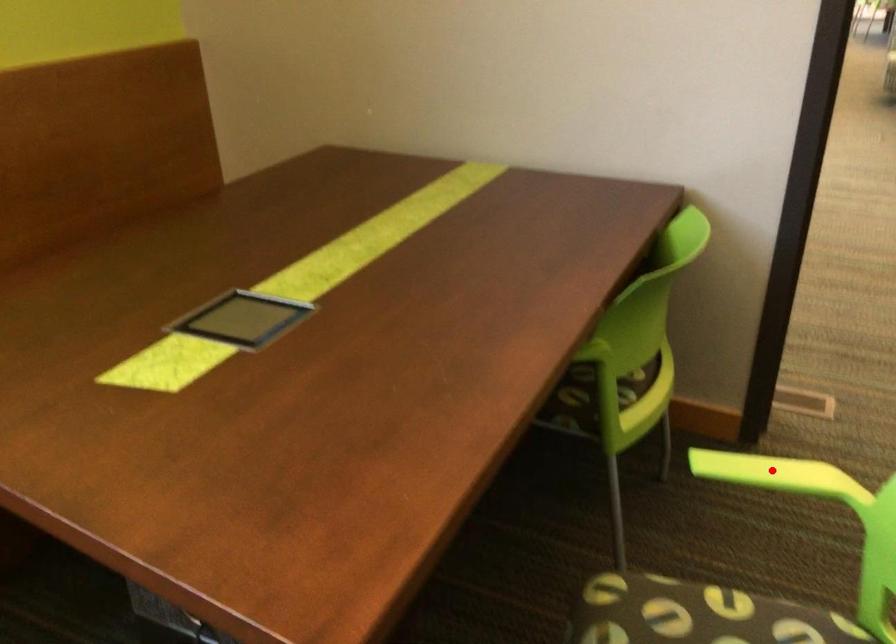
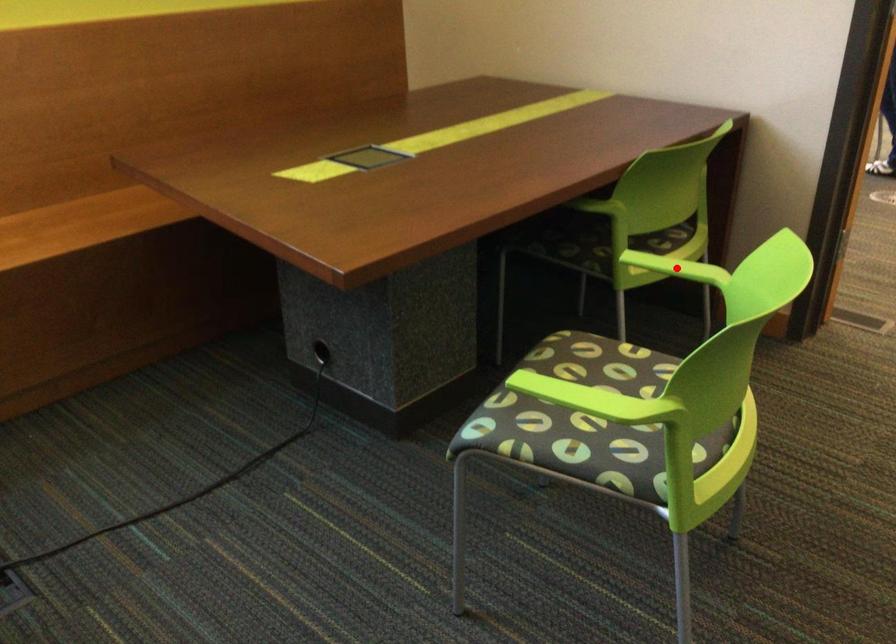
I am providing you with two images of the same scene from different viewpoints. A red point is marked on the first image and another point is marked on the second image. Do the highlighted points in image1 and image2 indicate the same real-world spot?

Yes